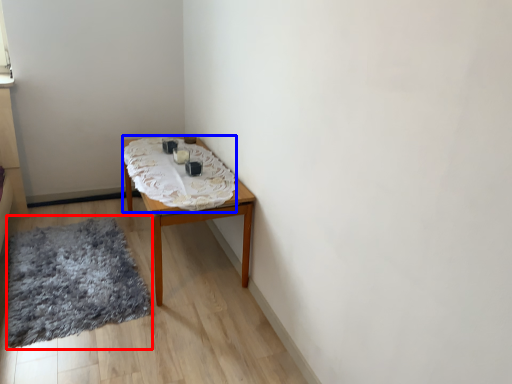
Question: Which object is closer to the camera taking this photo, mat (highlighted by a red box) or blanket (highlighted by a blue box)?

Choices:
 (A) mat
 (B) blanket

Answer: (A)